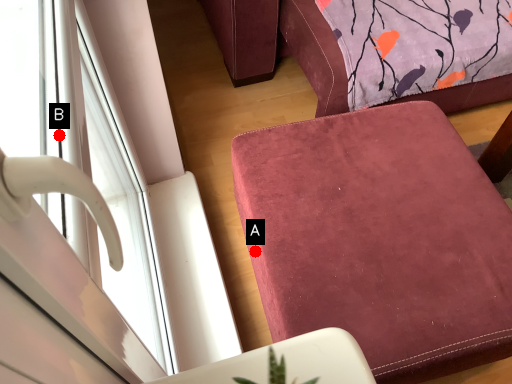
Question: Two points are circled on the image, labeled by A and B beside each circle. Which point is closer to the camera taking this photo?

Choices:
 (A) A is closer
 (B) B is closer

Answer: (B)